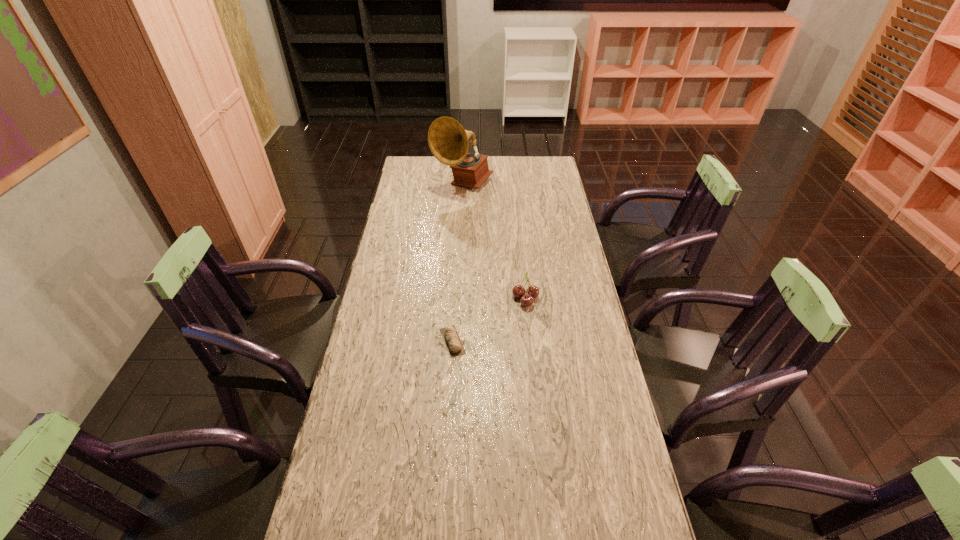
Locate an element on the screen. The image size is (960, 540). free space located on the right of the shortest object is located at coordinates (533, 341).

Identify the location of object present at the far edge. The image size is (960, 540). (448, 141).

At what (x,y) coordinates should I click in order to perform the action: click on object that is at the left edge. Please return your answer as a coordinate pair (x, y). The width and height of the screenshot is (960, 540). Looking at the image, I should click on (448, 141).

Find the location of a particular element. The height and width of the screenshot is (540, 960). object that is at the far left corner is located at coordinates (448, 141).

Locate an element on the screen. free location at the far edge is located at coordinates (448, 173).

Locate an element on the screen. This screenshot has width=960, height=540. free location at the left edge of the desktop is located at coordinates (330, 505).

Locate an element on the screen. The width and height of the screenshot is (960, 540). vacant space at the right edge is located at coordinates (583, 267).

At what (x,y) coordinates should I click in order to perform the action: click on empty space that is in between the farthest object and the cherry. Please return your answer as a coordinate pair (x, y). Looking at the image, I should click on tap(494, 241).

Where is `free space between the tallest object and the nearest object`? free space between the tallest object and the nearest object is located at coordinates (458, 263).

Locate an element on the screen. free space between the phonograph record and the pita bread is located at coordinates (458, 263).